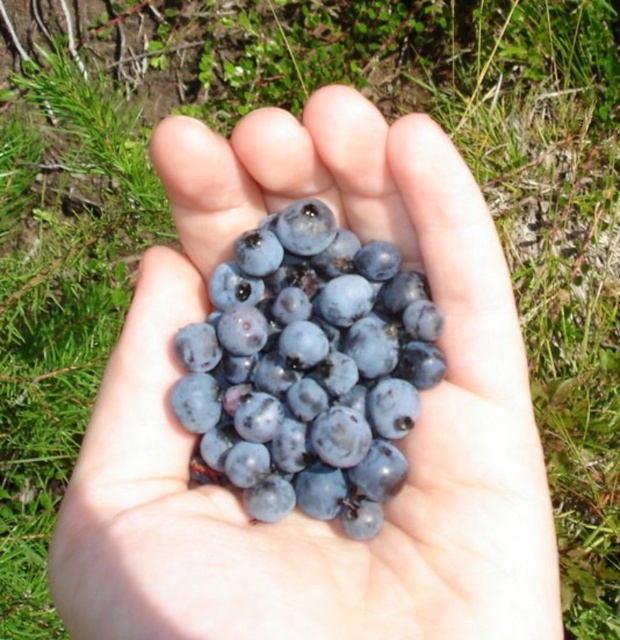
Question: In this image, where is glossy blueberries at center located relative to shiny dark blue grapes at center?

Choices:
 (A) above
 (B) below

Answer: (B)

Question: Which of the following is the closest to the observer?

Choices:
 (A) glossy blueberries at center
 (B) shiny dark blue grapes at center

Answer: (A)

Question: Does glossy blueberries at center lie behind shiny dark blue grapes at center?

Choices:
 (A) no
 (B) yes

Answer: (A)

Question: Is glossy blueberries at center positioned at the back of shiny dark blue grapes at center?

Choices:
 (A) yes
 (B) no

Answer: (B)